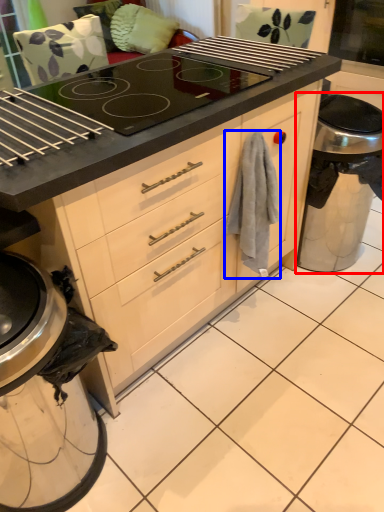
Question: Which of the following is the closest to the observer, appliance (highlighted by a red box) or material (highlighted by a blue box)?

Choices:
 (A) appliance
 (B) material

Answer: (B)